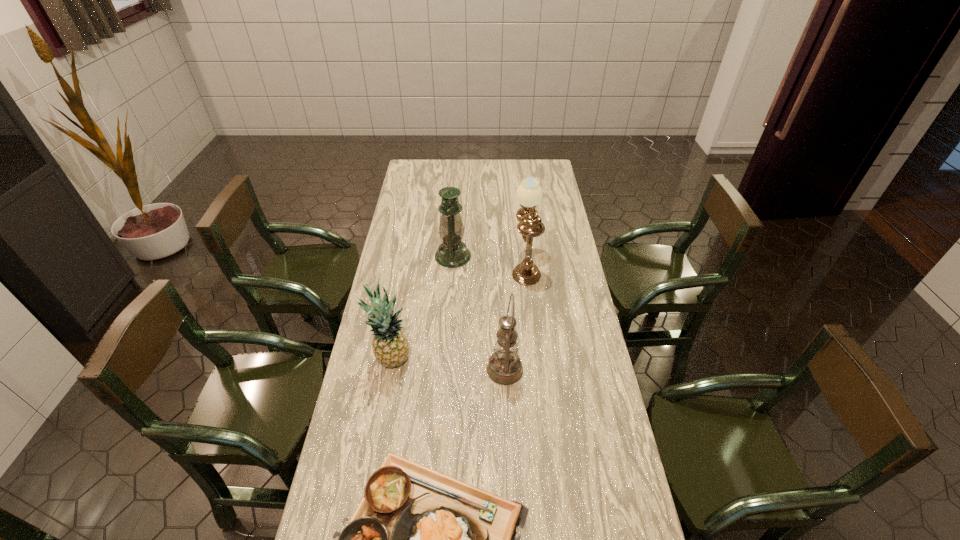
Where is `the leftmost oil lamp`? The image size is (960, 540). the leftmost oil lamp is located at coordinates (452, 253).

Where is `the nearest oil lamp`? The height and width of the screenshot is (540, 960). the nearest oil lamp is located at coordinates (505, 367).

The image size is (960, 540). I want to click on pineapple, so click(390, 346).

Locate an element on the screen. The height and width of the screenshot is (540, 960). free location located 0.360m on the front of the leftmost oil lamp is located at coordinates (447, 338).

Find the location of a particular element. This screenshot has height=540, width=960. vacant space positioned on the left of the nearest oil lamp is located at coordinates (408, 370).

You are a GUI agent. You are given a task and a screenshot of the screen. Output one action in this format:
    pyautogui.click(x=<x>, y=<y>)
    Task: Click on the free space located 0.080m on the front of the pineapple
    
    Given the screenshot: What is the action you would take?
    pyautogui.click(x=385, y=397)

Where is `object that is at the left edge`? object that is at the left edge is located at coordinates 390,346.

The height and width of the screenshot is (540, 960). I want to click on object located at the right edge, so click(529, 193).

You are a GUI agent. You are given a task and a screenshot of the screen. Output one action in this format:
    pyautogui.click(x=<x>, y=<y>)
    Task: Click on the vacant space at the far edge
    This screenshot has height=540, width=960.
    Given the screenshot: What is the action you would take?
    click(x=519, y=164)

You are a GUI agent. You are given a task and a screenshot of the screen. Output one action in this format:
    pyautogui.click(x=<x>, y=<y>)
    Task: Click on the blank space at the left edge of the desktop
    This screenshot has height=540, width=960.
    Given the screenshot: What is the action you would take?
    pyautogui.click(x=369, y=460)